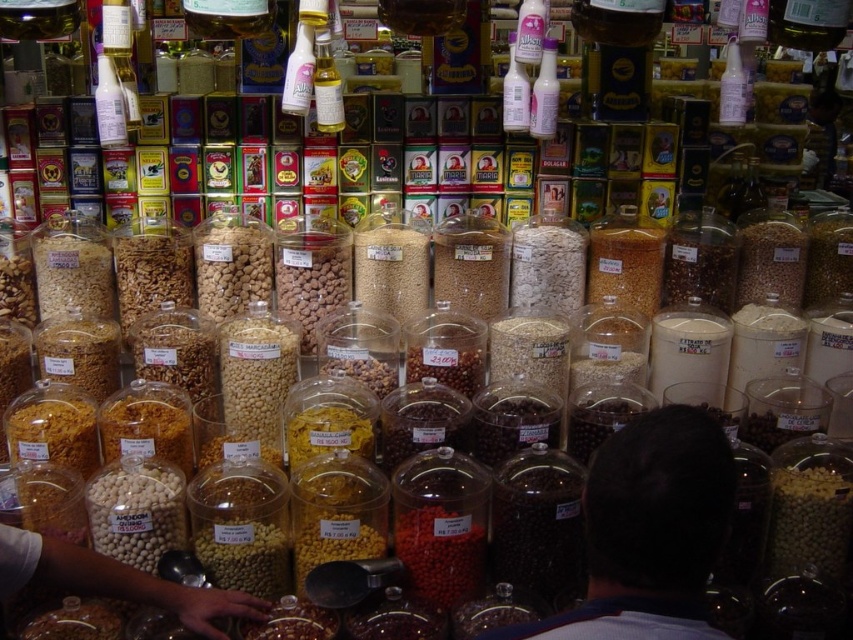
Does point (706, 548) lie in front of point (317, 96)?

That is True.

Does point (689, 480) come in front of point (328, 118)?

Yes, point (689, 480) is in front of point (328, 118).

Locate an element on the screen. dark brown hair at center is located at coordinates (648, 531).